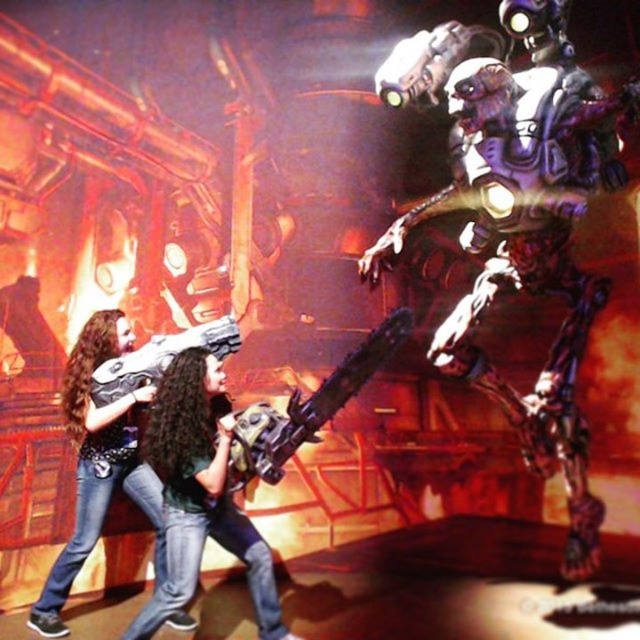
Question: Does matte black chainsaw at center appear on the right side of matte black gun at lower left?

Choices:
 (A) yes
 (B) no

Answer: (A)

Question: In this image, where is metallic purple robot at center located relative to matte black gun at lower left?

Choices:
 (A) left
 (B) right

Answer: (B)

Question: Can you confirm if metallic purple robot at center is positioned below metallic chainsaw at center?

Choices:
 (A) no
 (B) yes

Answer: (A)

Question: Which object is closer to the camera taking this photo?

Choices:
 (A) metallic chainsaw at center
 (B) matte black gun at lower left

Answer: (A)

Question: Among these objects, which one is farthest from the camera?

Choices:
 (A) metallic chainsaw at center
 (B) matte black guitar at lower left
 (C) matte black chainsaw at center

Answer: (B)

Question: Which point appears closest to the camera in this image?

Choices:
 (A) (364, 253)
 (B) (58, 609)
 (C) (131, 378)
 (D) (177, 444)

Answer: (D)